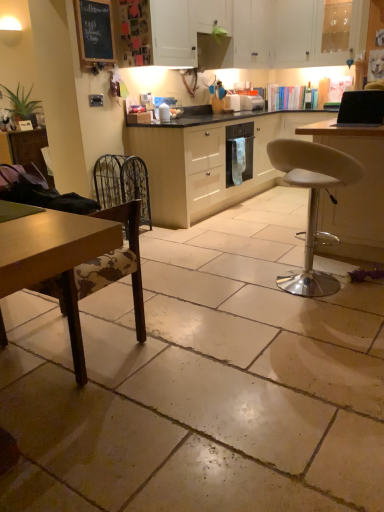
The width and height of the screenshot is (384, 512). I want to click on unoccupied region to the right of wooden chair at lower left, placed as the second chair when sorted from right to left, so click(x=178, y=341).